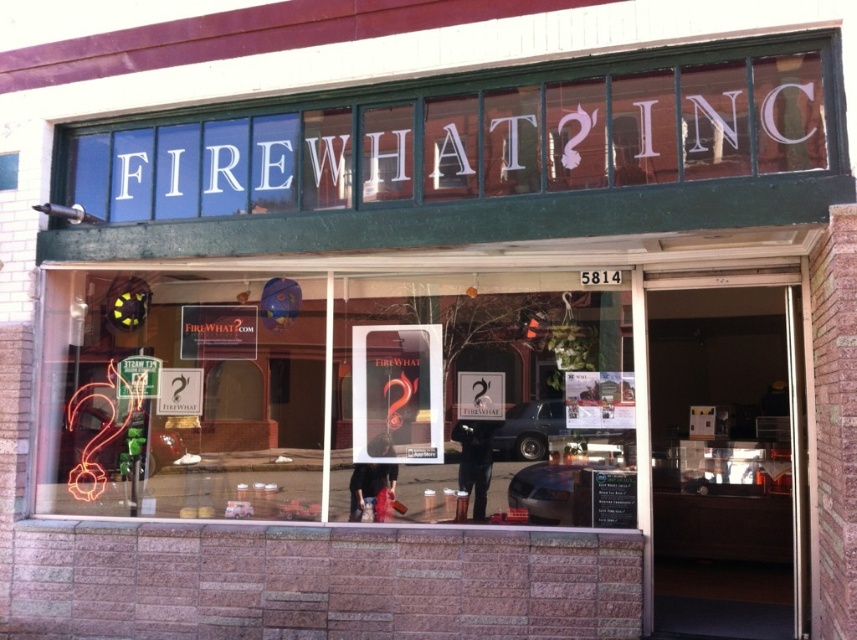
Is translucent glass window at center positioned at the back of neon orange sign at upper center?

That is True.

Which is in front, point (72, 394) or point (710, 156)?

Point (710, 156) is more forward.

The image size is (857, 640). I want to click on translucent glass window at center, so click(x=340, y=396).